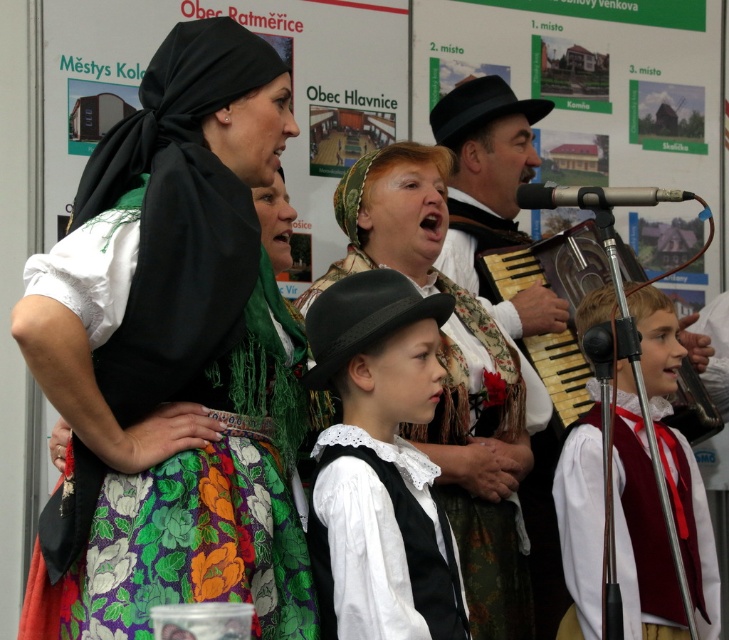
The width and height of the screenshot is (729, 640). Find the location of `white satin vest at center`. white satin vest at center is located at coordinates (639, 529).

Does white satin vest at center appear under silver metallic microphone at upper right?

Yes, white satin vest at center is below silver metallic microphone at upper right.

Is point (620, 369) positioned before point (574, 198)?

No, (620, 369) is behind (574, 198).

Find the location of a particular element. white satin vest at center is located at coordinates (639, 529).

Can you confirm if black felt hat at center is positioned to the left of silver metallic microphone at upper right?

No, black felt hat at center is not to the left of silver metallic microphone at upper right.

How distant is black felt hat at center from silver metallic microphone at upper right?

A distance of 3.93 meters exists between black felt hat at center and silver metallic microphone at upper right.

Which is in front, point (558, 584) or point (584, 192)?

Positioned in front is point (584, 192).

This screenshot has width=729, height=640. Identify the location of black felt hat at center. (491, 195).

Is black felt hat at center smaller than wooden accordion at center?

Correct, black felt hat at center occupies less space than wooden accordion at center.

Can you confirm if black felt hat at center is shorter than wooden accordion at center?

Indeed, black felt hat at center has a lesser height compared to wooden accordion at center.

What are the coordinates of `black felt hat at center` in the screenshot? It's located at (491, 195).